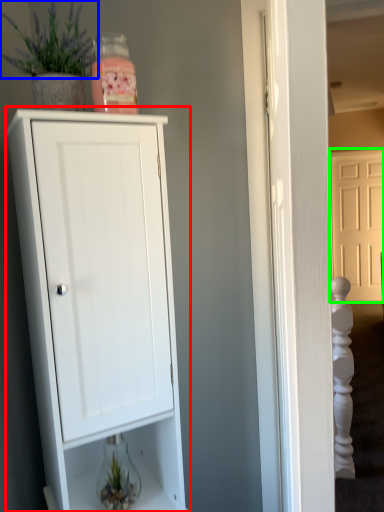
Question: Based on their relative distances, which object is farther from cupboard (highlighted by a red box)? Choose from plant (highlighted by a blue box) and door (highlighted by a green box).

Choices:
 (A) plant
 (B) door

Answer: (B)